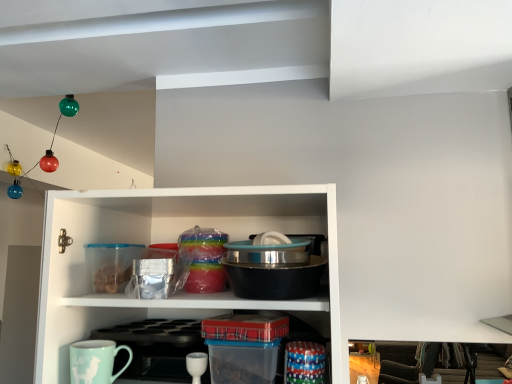
Question: Does white glossy cup at lower center lie behind teal glossy mug at lower left?

Choices:
 (A) yes
 (B) no

Answer: (A)

Question: Is white glossy cup at lower center positioned far away from teal glossy mug at lower left?

Choices:
 (A) yes
 (B) no

Answer: (B)

Question: From a real-world perspective, is white glossy cup at lower center on teal glossy mug at lower left?

Choices:
 (A) yes
 (B) no

Answer: (B)

Question: Considering the relative sizes of white glossy cup at lower center and teal glossy mug at lower left in the image provided, is white glossy cup at lower center thinner than teal glossy mug at lower left?

Choices:
 (A) no
 (B) yes

Answer: (A)

Question: Considering the relative sizes of white glossy cup at lower center and teal glossy mug at lower left in the image provided, is white glossy cup at lower center smaller than teal glossy mug at lower left?

Choices:
 (A) no
 (B) yes

Answer: (B)

Question: Would you say teal glossy mug at lower left is part of white glossy cup at lower center's contents?

Choices:
 (A) yes
 (B) no

Answer: (B)

Question: Does stainless steel bowl at center appear on the right side of teal glossy mug at lower left?

Choices:
 (A) no
 (B) yes

Answer: (B)

Question: From the image's perspective, is stainless steel bowl at center below teal glossy mug at lower left?

Choices:
 (A) no
 (B) yes

Answer: (A)

Question: From a real-world perspective, is stainless steel bowl at center below teal glossy mug at lower left?

Choices:
 (A) yes
 (B) no

Answer: (B)

Question: Does stainless steel bowl at center have a greater height compared to teal glossy mug at lower left?

Choices:
 (A) yes
 (B) no

Answer: (A)

Question: Can we say stainless steel bowl at center lies outside teal glossy mug at lower left?

Choices:
 (A) yes
 (B) no

Answer: (A)

Question: Is the surface of stainless steel bowl at center in direct contact with teal glossy mug at lower left?

Choices:
 (A) yes
 (B) no

Answer: (B)

Question: Considering the relative positions of teal glossy mug at lower left and stainless steel bowl at center in the image provided, is teal glossy mug at lower left to the left of stainless steel bowl at center from the viewer's perspective?

Choices:
 (A) no
 (B) yes

Answer: (B)